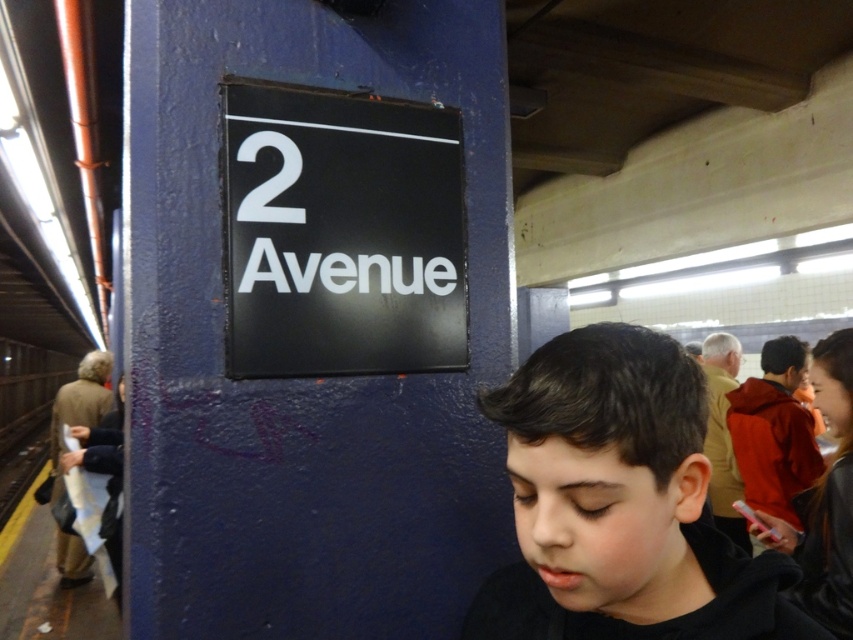
You are a photographer standing on the subway platform. You want to take a photo of both the black matte hair at center and the black matte sign at center. However, you can only focus on one object at a time. Which object should you focus on to ensure the other remains in the background?

You should focus on the black matte hair at center because it is closer to the viewer, and the black matte sign at center will naturally be in the background.

Based on the photo, you are standing on the subway platform and want to find the exact location of the point with coordinates (341,234). According to the scene description, where would this point be located?

The point with coordinates (341,234) is on the black matte sign at center.

You are a commuter waiting for the subway. You notice the black matte hair at center and the white matte number at upper center in your view. Which object is positioned higher in your field of view?

The white matte number at upper center is positioned higher in your field of view than the black matte hair at center.